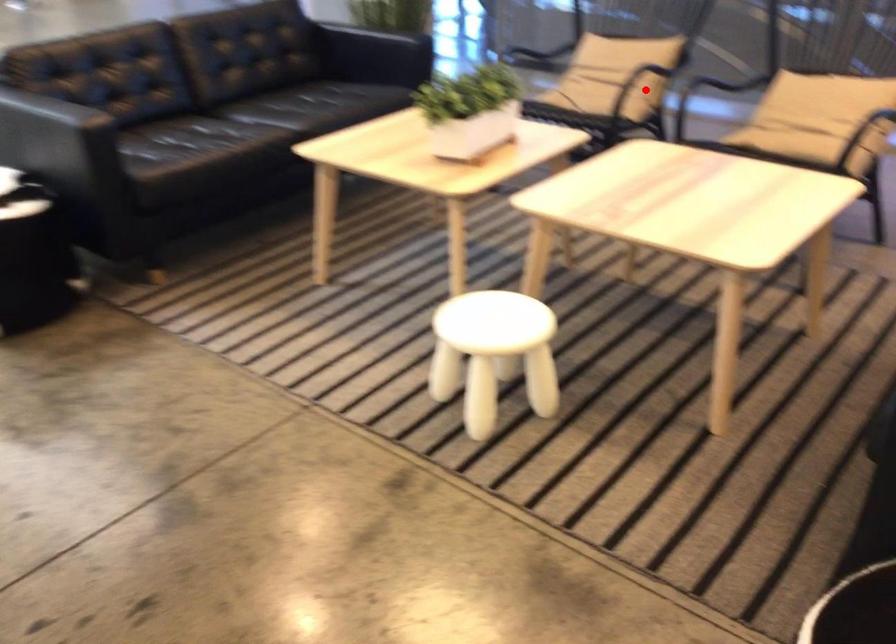
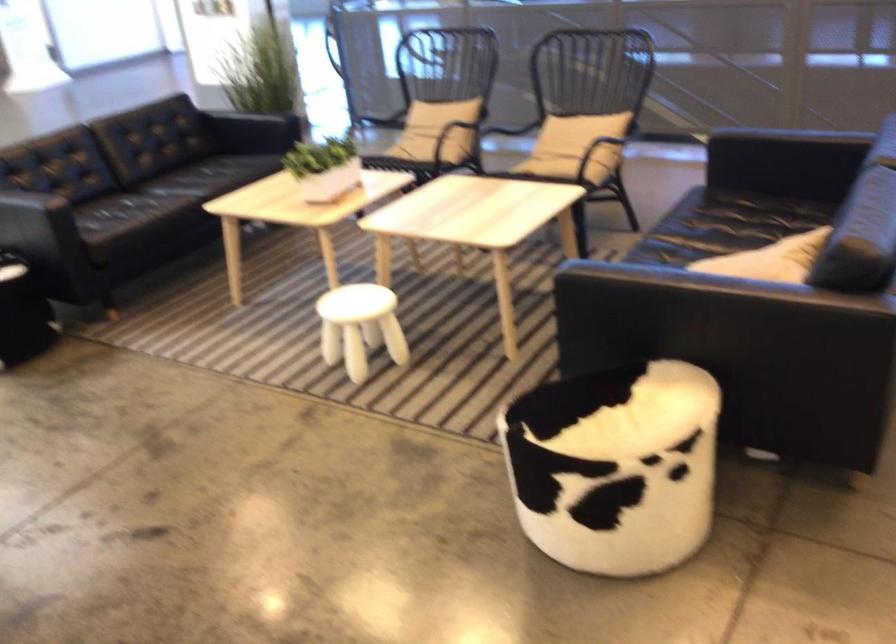
Locate, in the second image, the point that corresponds to the highlighted location in the first image.

(450, 135)